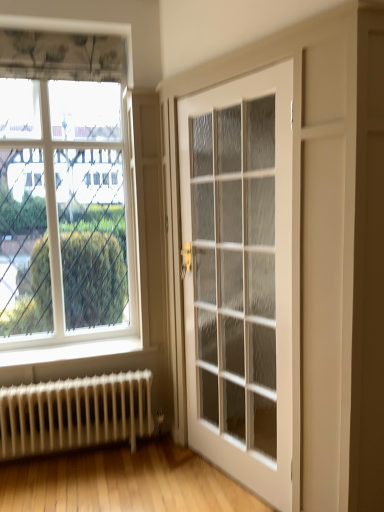
Question: Is white metal radiator at lower left in front of white glossy door at center?

Choices:
 (A) yes
 (B) no

Answer: (B)

Question: Considering the relative sizes of white metal radiator at lower left and white glossy door at center in the image provided, is white metal radiator at lower left bigger than white glossy door at center?

Choices:
 (A) yes
 (B) no

Answer: (B)

Question: From the image's perspective, would you say white metal radiator at lower left is positioned over white glossy door at center?

Choices:
 (A) no
 (B) yes

Answer: (A)

Question: From the image's perspective, does white metal radiator at lower left appear lower than white glossy door at center?

Choices:
 (A) yes
 (B) no

Answer: (A)

Question: Does white metal radiator at lower left turn towards white glossy door at center?

Choices:
 (A) yes
 (B) no

Answer: (B)

Question: Is white metal radiator at lower left thinner than white glossy door at center?

Choices:
 (A) yes
 (B) no

Answer: (B)

Question: From a real-world perspective, is white glossy door at center located beneath white metal radiator at lower left?

Choices:
 (A) no
 (B) yes

Answer: (A)

Question: Does white glossy door at center have a greater width compared to white metal radiator at lower left?

Choices:
 (A) no
 (B) yes

Answer: (A)

Question: Is white glossy door at center shorter than white metal radiator at lower left?

Choices:
 (A) yes
 (B) no

Answer: (B)

Question: Does white glossy door at center have a smaller size compared to white metal radiator at lower left?

Choices:
 (A) yes
 (B) no

Answer: (B)

Question: Would you say white glossy door at center is outside white metal radiator at lower left?

Choices:
 (A) yes
 (B) no

Answer: (A)

Question: From a real-world perspective, is white glossy door at center positioned over white metal radiator at lower left based on gravity?

Choices:
 (A) yes
 (B) no

Answer: (A)

Question: From a real-world perspective, is clear glass window at upper left positioned under white glossy door at center based on gravity?

Choices:
 (A) no
 (B) yes

Answer: (A)